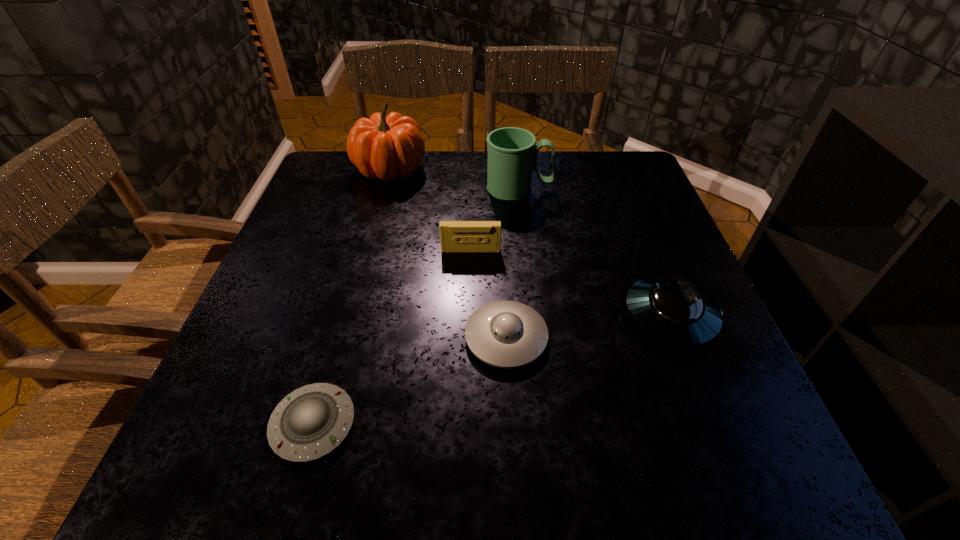
Locate an element on the screen. The width and height of the screenshot is (960, 540). free space between the nearest object and the videotape is located at coordinates (393, 338).

The image size is (960, 540). In order to click on free space that is in between the shortest object and the tallest object in this screenshot , I will do `click(352, 297)`.

I want to click on free space between the second shortest saucer and the second tallest object, so click(x=513, y=264).

Where is `empty space that is in between the shortest saucer and the pumpkin`? The image size is (960, 540). empty space that is in between the shortest saucer and the pumpkin is located at coordinates (352, 297).

Where is `free area in between the leftmost saucer and the pumpkin`? The width and height of the screenshot is (960, 540). free area in between the leftmost saucer and the pumpkin is located at coordinates (352, 297).

Locate an element on the screen. The width and height of the screenshot is (960, 540). free spot between the videotape and the fifth shortest object is located at coordinates (495, 220).

I want to click on vacant space that's between the pumpkin and the fifth shortest object, so click(x=455, y=179).

The image size is (960, 540). Find the location of `empty space between the leftmost saucer and the second shortest saucer`. empty space between the leftmost saucer and the second shortest saucer is located at coordinates (410, 381).

The image size is (960, 540). What are the coordinates of `empty location between the second saucer from left to right and the pumpkin` in the screenshot? It's located at (448, 253).

Find the location of `vacant space that is in between the videotape and the rightmost saucer`. vacant space that is in between the videotape and the rightmost saucer is located at coordinates (570, 283).